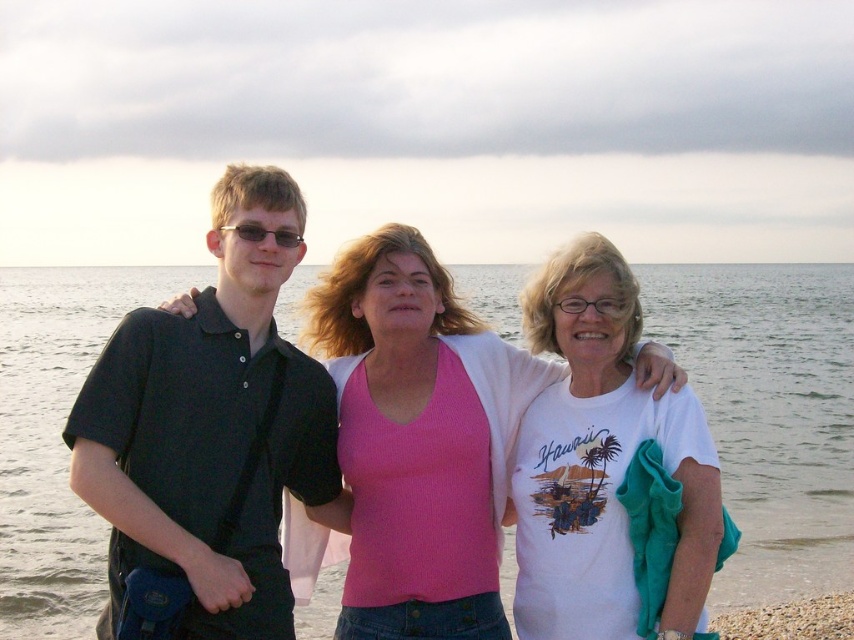
You are a photographer trying to capture a group photo of the black matte shirt at left and the white cotton shirt at center. Based on their sizes, which one should you place closer to the camera to ensure both appear proportionally sized in the photo?

Since the black matte shirt at left is wider than the white cotton shirt at center, you should position the black matte shirt at left farther away from the camera and the white cotton shirt at center closer. This way, their apparent sizes in the photo will balance out.

You are standing in front of the beach scene. You need to locate the black matte shirt at left. Where is it positioned in terms of coordinates?

The black matte shirt at left is positioned at coordinates (212, 426).

You are a photographer trying to capture a group photo of the black matte shirt at left and the white cotton shirt at center. Based on their positions in the image, which one should you adjust to ensure both are fully visible in the frame?

The black matte shirt at left is below the white cotton shirt at center, so you should adjust the angle or position of the camera to ensure both are fully visible in the frame.